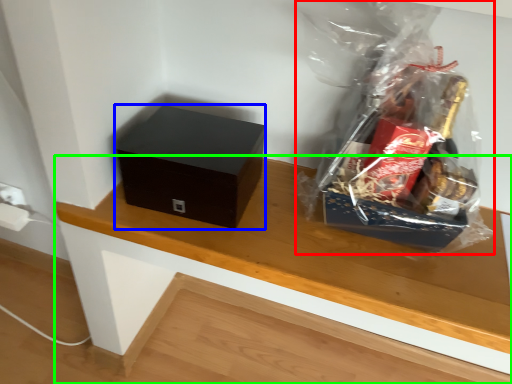
Question: Which is nearer to the plastic bag (highlighted by a red box)? box (highlighted by a blue box) or table (highlighted by a green box).

Choices:
 (A) box
 (B) table

Answer: (B)